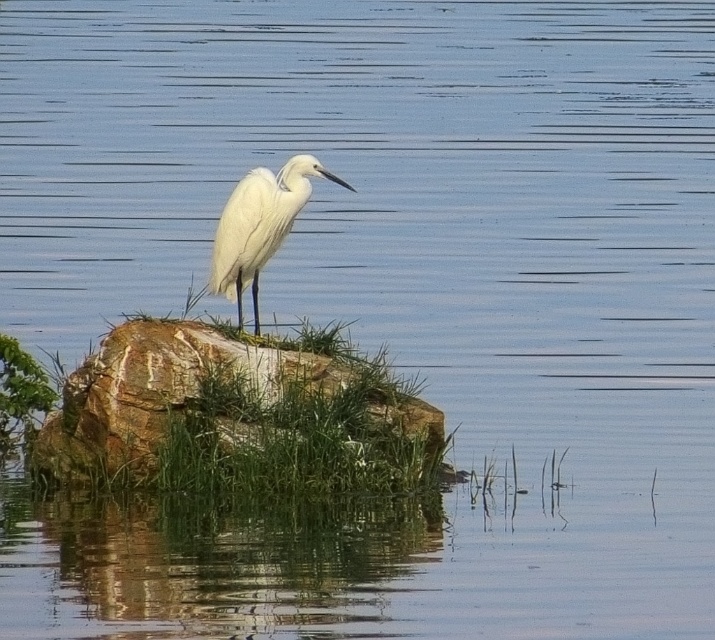
You are a photographer trying to capture the brown rough rock at center and the white feathered bird at center in the same frame. Which object will appear larger in your photo?

The white feathered bird at center will appear larger in the photo because it is taller than the brown rough rock at center.

You are standing at the edge of the water in the serene natural scene. You see a point marked at coordinates (154, 392). What object is located at that point?

The point at coordinates (154, 392) marks the brown rough rock at center.